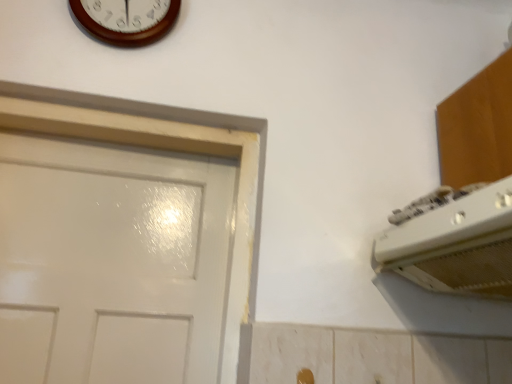
In order to click on white plastic air conditioner at upper right in this screenshot , I will do `click(453, 240)`.

From a real-world perspective, which object rests below the other?

From a 3D spatial view, white plastic air conditioner at upper right is below.

Choose the correct answer: Is white plastic air conditioner at upper right inside wooden wall clock at upper center or outside it?

The correct answer is: outside.

Could you measure the distance between white plastic air conditioner at upper right and wooden wall clock at upper center?

white plastic air conditioner at upper right is 36.03 inches from wooden wall clock at upper center.

Considering the relative sizes of white plastic air conditioner at upper right and wooden wall clock at upper center in the image provided, is white plastic air conditioner at upper right bigger than wooden wall clock at upper center?

Yes.

Would you say gold metallic door handle at lower center is a long distance from wooden wall clock at upper center?

Absolutely, gold metallic door handle at lower center is distant from wooden wall clock at upper center.

Consider the image. From a real-world perspective, is gold metallic door handle at lower center positioned under wooden wall clock at upper center based on gravity?

Yes, from a real-world perspective, gold metallic door handle at lower center is under wooden wall clock at upper center.

Does gold metallic door handle at lower center have a larger size compared to wooden wall clock at upper center?

No.

From the image's perspective, is gold metallic door handle at lower center located above or below wooden wall clock at upper center?

From the image's perspective, gold metallic door handle at lower center appears below wooden wall clock at upper center.

What's the angular difference between wooden wall clock at upper center and white plastic air conditioner at upper right's facing directions?

The angle between the facing direction of wooden wall clock at upper center and the facing direction of white plastic air conditioner at upper right is 89.2 degrees.

Considering the relative sizes of wooden wall clock at upper center and white plastic air conditioner at upper right in the image provided, is wooden wall clock at upper center thinner than white plastic air conditioner at upper right?

Indeed, wooden wall clock at upper center has a lesser width compared to white plastic air conditioner at upper right.

You are a GUI agent. You are given a task and a screenshot of the screen. Output one action in this format:
    pyautogui.click(x=<x>, y=<y>)
    Task: Click on the appliance in front of the wooden wall clock at upper center
    Image resolution: width=512 pixels, height=384 pixels.
    Given the screenshot: What is the action you would take?
    pyautogui.click(x=453, y=240)

How far apart are wooden wall clock at upper center and white plastic air conditioner at upper right?

A distance of 36.03 inches exists between wooden wall clock at upper center and white plastic air conditioner at upper right.

Does gold metallic door handle at lower center have a greater height compared to white plastic air conditioner at upper right?

No, gold metallic door handle at lower center is not taller than white plastic air conditioner at upper right.

Can you tell me how much gold metallic door handle at lower center and white plastic air conditioner at upper right differ in facing direction?

There is a 88.3-degree angle between the facing directions of gold metallic door handle at lower center and white plastic air conditioner at upper right.

Is gold metallic door handle at lower center at the right side of white plastic air conditioner at upper right?

Incorrect, gold metallic door handle at lower center is not on the right side of white plastic air conditioner at upper right.

Is gold metallic door handle at lower center situated inside white plastic air conditioner at upper right or outside?

→ The correct answer is: outside.

Where is `door handle behind the white plastic air conditioner at upper right`? door handle behind the white plastic air conditioner at upper right is located at coordinates (305, 376).

Can you confirm if white plastic air conditioner at upper right is positioned to the right of gold metallic door handle at lower center?

Yes, white plastic air conditioner at upper right is to the right of gold metallic door handle at lower center.

Would you say wooden wall clock at upper center contains gold metallic door handle at lower center?

That's incorrect, gold metallic door handle at lower center is not inside wooden wall clock at upper center.

Which object is positioned more to the right, wooden wall clock at upper center or gold metallic door handle at lower center?

gold metallic door handle at lower center.

Is wooden wall clock at upper center taller or shorter than gold metallic door handle at lower center?

wooden wall clock at upper center is taller than gold metallic door handle at lower center.

Is wooden wall clock at upper center far away from gold metallic door handle at lower center?

Yes, wooden wall clock at upper center and gold metallic door handle at lower center are located far from each other.

Where is `appliance lying below the wooden wall clock at upper center (from the image's perspective)`? The height and width of the screenshot is (384, 512). appliance lying below the wooden wall clock at upper center (from the image's perspective) is located at coordinates (453, 240).

Find the location of `wall clock lying above the gold metallic door handle at lower center (from the image's perspective)`. wall clock lying above the gold metallic door handle at lower center (from the image's perspective) is located at coordinates (126, 19).

Looking at the image, which one is located closer to wooden wall clock at upper center, white plastic air conditioner at upper right or gold metallic door handle at lower center?

The object closer to wooden wall clock at upper center is white plastic air conditioner at upper right.

When comparing their distances from white plastic air conditioner at upper right, does gold metallic door handle at lower center or wooden wall clock at upper center seem further?

Based on the image, wooden wall clock at upper center appears to be further to white plastic air conditioner at upper right.

Considering their positions, is wooden wall clock at upper center positioned closer to white plastic air conditioner at upper right than gold metallic door handle at lower center?

gold metallic door handle at lower center is positioned closer to the anchor white plastic air conditioner at upper right.

Considering their positions, is wooden wall clock at upper center positioned further to gold metallic door handle at lower center than white plastic air conditioner at upper right?

wooden wall clock at upper center lies further to gold metallic door handle at lower center than the other object.

Based on the photo, looking at the image, which one is located further to gold metallic door handle at lower center, white plastic air conditioner at upper right or wooden wall clock at upper center?

The object further to gold metallic door handle at lower center is wooden wall clock at upper center.

When comparing their distances from wooden wall clock at upper center, does gold metallic door handle at lower center or white plastic air conditioner at upper right seem closer?

white plastic air conditioner at upper right.

Locate an element on the screen. appliance between wooden wall clock at upper center and gold metallic door handle at lower center vertically is located at coordinates (453, 240).